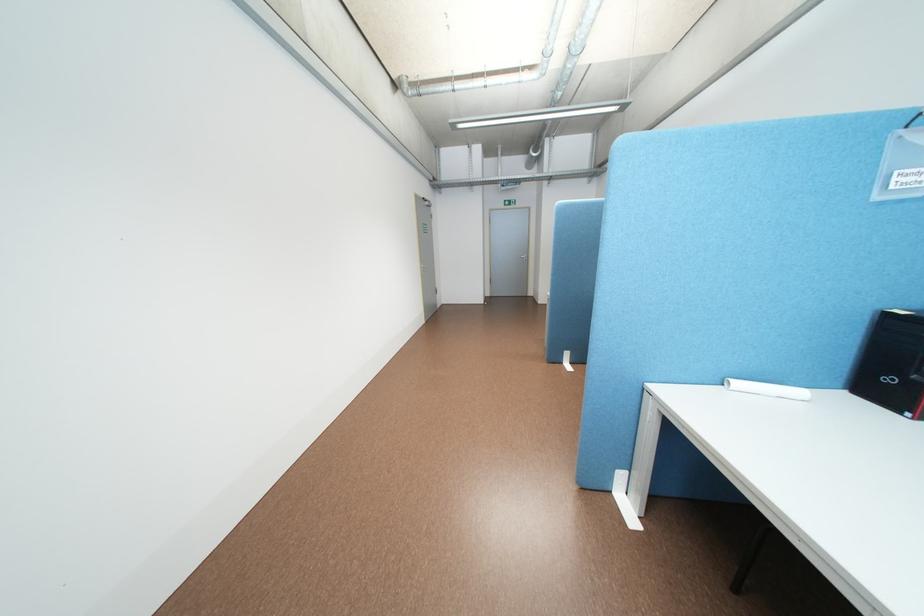
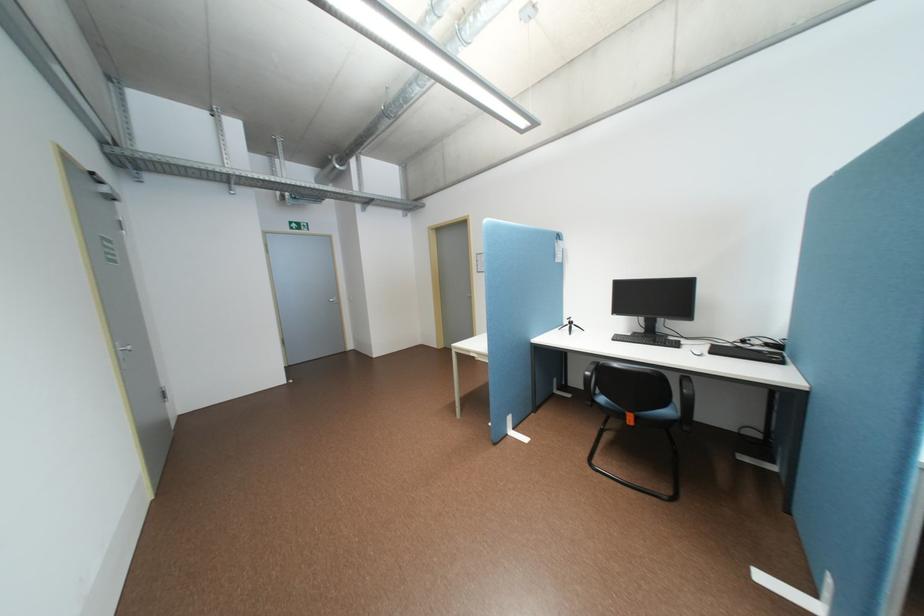
Find the pixel in the second image that matches [561,177] in the first image.

(379, 201)